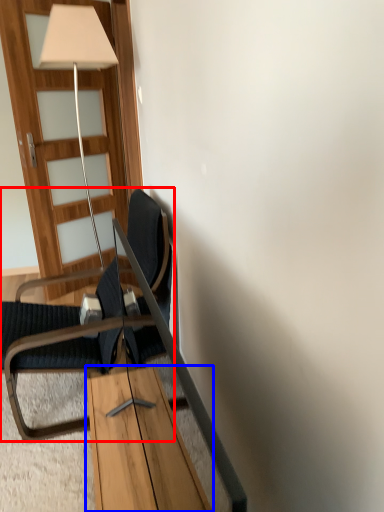
Question: Which of the following is the farthest to the observer, chair (highlighted by a red box) or table (highlighted by a blue box)?

Choices:
 (A) chair
 (B) table

Answer: (A)